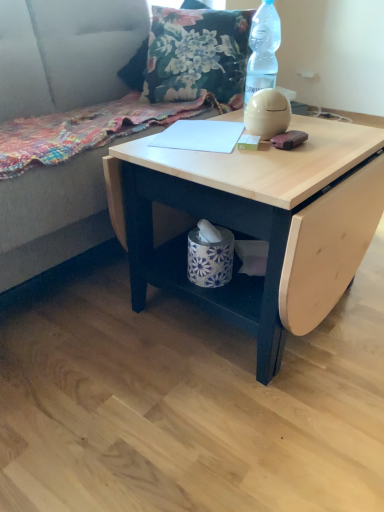
Question: Is suede gray couch at upper left a part of white paper at center?

Choices:
 (A) no
 (B) yes

Answer: (A)

Question: Does white paper at center have a greater height compared to suede gray couch at upper left?

Choices:
 (A) no
 (B) yes

Answer: (A)

Question: From a real-world perspective, is white paper at center positioned under suede gray couch at upper left based on gravity?

Choices:
 (A) no
 (B) yes

Answer: (A)

Question: From the image's perspective, is white paper at center beneath suede gray couch at upper left?

Choices:
 (A) no
 (B) yes

Answer: (B)

Question: Is white paper at center outside of suede gray couch at upper left?

Choices:
 (A) no
 (B) yes

Answer: (B)

Question: Are white paper at center and suede gray couch at upper left making contact?

Choices:
 (A) no
 (B) yes

Answer: (A)

Question: Does light wood table at center come behind floral fabric pillow at upper center?

Choices:
 (A) no
 (B) yes

Answer: (A)

Question: From the image's perspective, is light wood table at center under floral fabric pillow at upper center?

Choices:
 (A) yes
 (B) no

Answer: (A)

Question: Is floral fabric pillow at upper center surrounded by light wood table at center?

Choices:
 (A) no
 (B) yes

Answer: (A)

Question: From a real-world perspective, is light wood table at center below floral fabric pillow at upper center?

Choices:
 (A) no
 (B) yes

Answer: (B)

Question: Is light wood table at center shorter than floral fabric pillow at upper center?

Choices:
 (A) yes
 (B) no

Answer: (B)

Question: Considering the relative positions of light wood table at center and floral fabric pillow at upper center in the image provided, is light wood table at center in front of floral fabric pillow at upper center?

Choices:
 (A) yes
 (B) no

Answer: (A)

Question: Is transparent plastic bottle at upper right next to white paper at center?

Choices:
 (A) no
 (B) yes

Answer: (A)